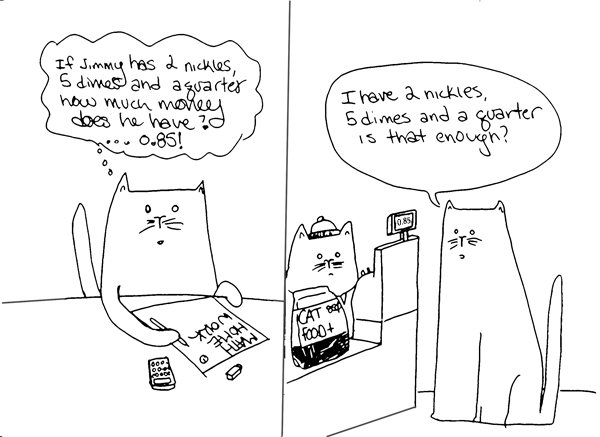
You are a GUI agent. You are given a task and a screenshot of the screen. Output one action in this format:
    pyautogui.click(x=<x>, y=<y>)
    Task: Click on the pen
    The height and width of the screenshot is (437, 600).
    Given the screenshot: What is the action you would take?
    pyautogui.click(x=182, y=342)